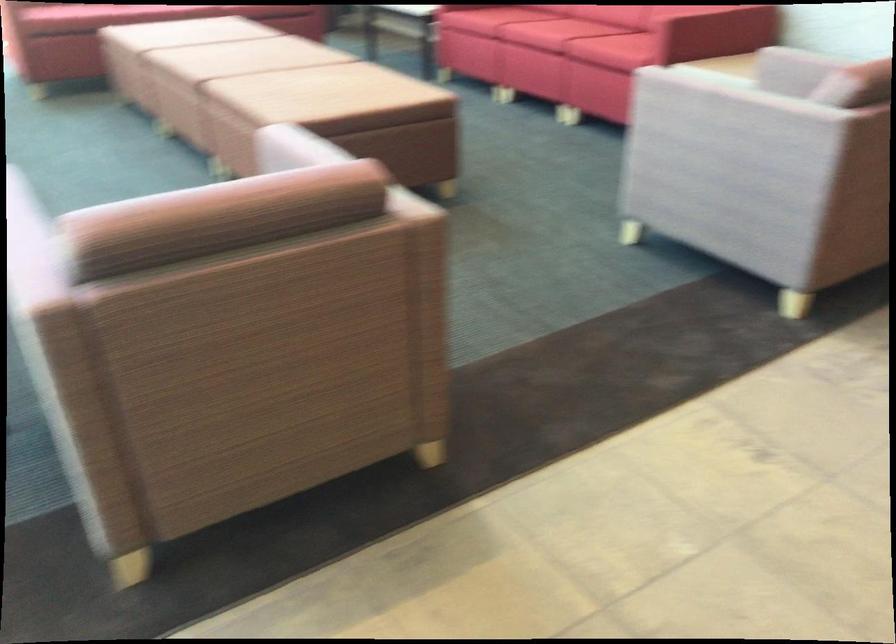
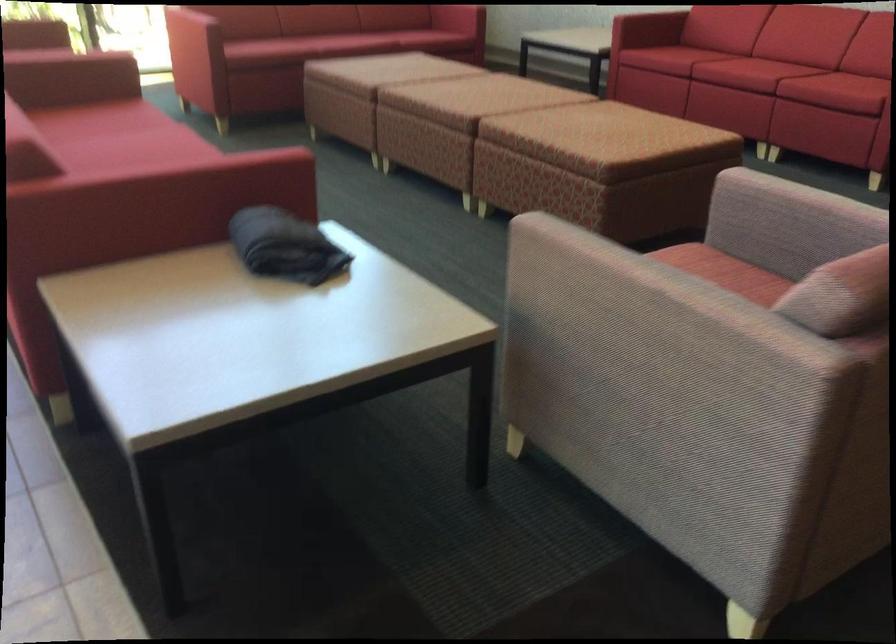
How did the camera likely rotate?

The rotation direction of the camera is right-down.